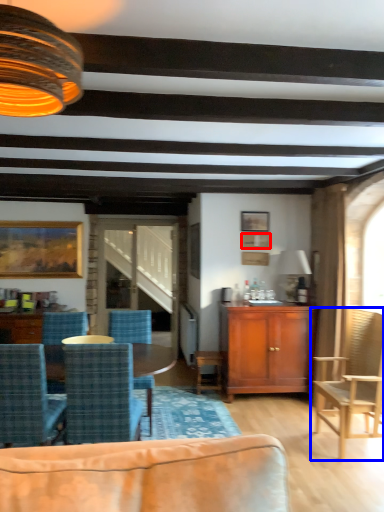
Question: Which of the following is the farthest to the observer, picture frame (highlighted by a red box) or chair (highlighted by a blue box)?

Choices:
 (A) picture frame
 (B) chair

Answer: (A)